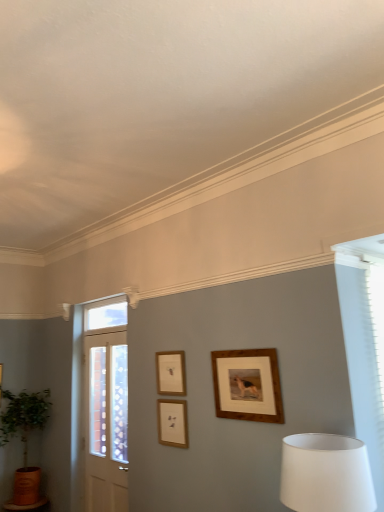
You are a GUI agent. You are given a task and a screenshot of the screen. Output one action in this format:
    pyautogui.click(x=<x>, y=<y>)
    Task: Click on the white wood door at left
    The image size is (384, 512).
    Given the screenshot: What is the action you would take?
    pyautogui.click(x=100, y=407)

This screenshot has width=384, height=512. What are the coordinates of `wooden picture frame at center, the second picture frame viewed from the left` in the screenshot? It's located at (172, 422).

The image size is (384, 512). What do you see at coordinates (24, 442) in the screenshot?
I see `green leafy plant in terracotta pot at lower left` at bounding box center [24, 442].

In order to click on white fabric lampshade at lower right in this screenshot , I will do click(x=326, y=473).

This screenshot has height=512, width=384. Find the location of `white wood door at left`. white wood door at left is located at coordinates (100, 407).

Is clear glass window at upper center positioned with its back to wooden picture frame at center, the second picture frame viewed from the left?

clear glass window at upper center does not have its back to wooden picture frame at center, the second picture frame viewed from the left.

Considering their positions, is clear glass window at upper center located in front of or behind wooden picture frame at center, the second picture frame viewed from the left?

Visually, clear glass window at upper center is located behind wooden picture frame at center, the second picture frame viewed from the left.

Which picture frame is the 2nd one when counting from the right side of the clear glass window at upper center? Please provide its 2D coordinates.

[(172, 422)]

From a real-world perspective, which object rests below the other?

wooden picture frame at center, the 2th picture frame viewed from the right, is physically lower.

From a real-world perspective, is wooden picture frame at center, which appears as the 3th picture frame when viewed from the left, below wooden picture frame at upper center, which ranks as the 1th picture frame in left-to-right order?

Yes, from a real-world perspective, wooden picture frame at center, which appears as the 3th picture frame when viewed from the left, is below wooden picture frame at upper center, which ranks as the 1th picture frame in left-to-right order.

From the image's perspective, is wooden picture frame at center, which appears as the 3th picture frame when viewed from the left, located above or below wooden picture frame at upper center, which ranks as the 1th picture frame in left-to-right order?

wooden picture frame at center, which appears as the 3th picture frame when viewed from the left, is above wooden picture frame at upper center, which ranks as the 1th picture frame in left-to-right order.

Is point (255, 361) in front of point (170, 380)?

That is True.

Which of these two, wooden picture frame at center, the 1th picture frame viewed from the right, or wooden picture frame at upper center, which ranks as the 1th picture frame in left-to-right order, is bigger?

wooden picture frame at center, the 1th picture frame viewed from the right, is bigger.

How different are the orientations of green leafy plant in terracotta pot at lower left and clear glass window at upper center in degrees?

They differ by 89.8 degrees in their facing directions.

Measure the distance between green leafy plant in terracotta pot at lower left and clear glass window at upper center.

A: green leafy plant in terracotta pot at lower left is 1.07 meters away from clear glass window at upper center.

Is the surface of green leafy plant in terracotta pot at lower left in direct contact with clear glass window at upper center?

green leafy plant in terracotta pot at lower left is not next to clear glass window at upper center, and they're not touching.

Based on their sizes in the image, would you say green leafy plant in terracotta pot at lower left is bigger or smaller than clear glass window at upper center?

In the image, green leafy plant in terracotta pot at lower left appears to be larger than clear glass window at upper center.

Between green leafy plant in terracotta pot at lower left and wooden picture frame at center, the 2th picture frame viewed from the right, which one has smaller width?

wooden picture frame at center, the 2th picture frame viewed from the right.

Between green leafy plant in terracotta pot at lower left and wooden picture frame at center, the second picture frame viewed from the left, which one is positioned behind?

green leafy plant in terracotta pot at lower left is more distant.

Is wooden picture frame at center, the second picture frame viewed from the left, surrounded by green leafy plant in terracotta pot at lower left?

No, green leafy plant in terracotta pot at lower left does not contain wooden picture frame at center, the second picture frame viewed from the left.

Is green leafy plant in terracotta pot at lower left positioned behind white wood door at left?

Yes, the depth of green leafy plant in terracotta pot at lower left is greater than that of white wood door at left.

Is green leafy plant in terracotta pot at lower left looking in the opposite direction of white wood door at left?

green leafy plant in terracotta pot at lower left does not have its back to white wood door at left.

From a real-world perspective, is green leafy plant in terracotta pot at lower left physically located above or below white wood door at left?

From a real-world perspective, green leafy plant in terracotta pot at lower left is physically below white wood door at left.

Which of these two, green leafy plant in terracotta pot at lower left or white wood door at left, is bigger?

With larger size is green leafy plant in terracotta pot at lower left.

Is wooden picture frame at upper center, which ranks as the 1th picture frame in left-to-right order, closer to the viewer compared to wooden picture frame at center, the 2th picture frame viewed from the right?

No, wooden picture frame at upper center, which ranks as the 1th picture frame in left-to-right order, is behind wooden picture frame at center, the 2th picture frame viewed from the right.

Can you confirm if wooden picture frame at upper center, positioned as the 3th picture frame in right-to-left order, is positioned to the right of wooden picture frame at center, the 2th picture frame viewed from the right?

In fact, wooden picture frame at upper center, positioned as the 3th picture frame in right-to-left order, is to the left of wooden picture frame at center, the 2th picture frame viewed from the right.

Identify the location of the 1st picture frame to the right when counting from the wooden picture frame at upper center, positioned as the 3th picture frame in right-to-left order. This screenshot has height=512, width=384. (172, 422).

In terms of size, does wooden picture frame at upper center, positioned as the 3th picture frame in right-to-left order, appear bigger or smaller than wooden picture frame at center, the second picture frame viewed from the left?

wooden picture frame at upper center, positioned as the 3th picture frame in right-to-left order, is bigger than wooden picture frame at center, the second picture frame viewed from the left.

From the picture: Is wooden picture frame at center, the second picture frame viewed from the left, aimed at clear glass window at upper center?

No, wooden picture frame at center, the second picture frame viewed from the left, is not facing towards clear glass window at upper center.

Is there a large distance between wooden picture frame at center, the second picture frame viewed from the left, and clear glass window at upper center?

Yes, wooden picture frame at center, the second picture frame viewed from the left, is far from clear glass window at upper center.

From the image's perspective, is wooden picture frame at center, the 2th picture frame viewed from the right, positioned above or below clear glass window at upper center?

From the image's perspective, wooden picture frame at center, the 2th picture frame viewed from the right, appears below clear glass window at upper center.

You are a GUI agent. You are given a task and a screenshot of the screen. Output one action in this format:
    pyautogui.click(x=<x>, y=<y>)
    Task: Click on the window lying above the wooden picture frame at center, the second picture frame viewed from the left (from the image's perspective)
    The width and height of the screenshot is (384, 512).
    Given the screenshot: What is the action you would take?
    pyautogui.click(x=106, y=316)

You are a GUI agent. You are given a task and a screenshot of the screen. Output one action in this format:
    pyautogui.click(x=<x>, y=<y>)
    Task: Click on the window on the left of wooden picture frame at center, the 2th picture frame viewed from the right
    The width and height of the screenshot is (384, 512).
    Given the screenshot: What is the action you would take?
    pyautogui.click(x=106, y=316)

There is a wooden picture frame at center, which appears as the 3th picture frame when viewed from the left. Identify the location of the 1st picture frame below it (from the image's perspective). (170, 373).

When comparing their distances from wooden picture frame at upper center, which ranks as the 1th picture frame in left-to-right order, does green leafy plant in terracotta pot at lower left or white wood door at left seem closer?

white wood door at left.

From the image, which object appears to be farther from white fabric lampshade at lower right, clear glass window at upper center or green leafy plant in terracotta pot at lower left?

Based on the image, green leafy plant in terracotta pot at lower left appears to be further to white fabric lampshade at lower right.

Looking at the image, which one is located closer to wooden picture frame at center, which appears as the 3th picture frame when viewed from the left, white wood door at left or wooden picture frame at center, the 2th picture frame viewed from the right?

wooden picture frame at center, the 2th picture frame viewed from the right, is positioned closer to the anchor wooden picture frame at center, which appears as the 3th picture frame when viewed from the left.

Considering their positions, is wooden picture frame at center, which appears as the 3th picture frame when viewed from the left, positioned closer to white wood door at left than green leafy plant in terracotta pot at lower left?

green leafy plant in terracotta pot at lower left.

Estimate the real-world distances between objects in this image. Which object is closer to wooden picture frame at upper center, which ranks as the 1th picture frame in left-to-right order, wooden picture frame at center, the second picture frame viewed from the left, or white fabric lampshade at lower right?

wooden picture frame at center, the second picture frame viewed from the left.

When comparing their distances from wooden picture frame at upper center, which ranks as the 1th picture frame in left-to-right order, does clear glass window at upper center or wooden picture frame at center, the 1th picture frame viewed from the right, seem further?

clear glass window at upper center is positioned further to the anchor wooden picture frame at upper center, which ranks as the 1th picture frame in left-to-right order.

When comparing their distances from wooden picture frame at center, the 2th picture frame viewed from the right, does white fabric lampshade at lower right or clear glass window at upper center seem further?

Among the two, white fabric lampshade at lower right is located further to wooden picture frame at center, the 2th picture frame viewed from the right.

Which object lies nearer to the anchor point white wood door at left, white fabric lampshade at lower right or wooden picture frame at center, the 2th picture frame viewed from the right?

wooden picture frame at center, the 2th picture frame viewed from the right, is positioned closer to the anchor white wood door at left.

This screenshot has height=512, width=384. I want to click on picture frame between wooden picture frame at center, the 1th picture frame viewed from the right, and wooden picture frame at upper center, which ranks as the 1th picture frame in left-to-right order, in the front-back direction, so click(172, 422).

This screenshot has height=512, width=384. I want to click on door between clear glass window at upper center and green leafy plant in terracotta pot at lower left from top to bottom, so click(100, 407).

The width and height of the screenshot is (384, 512). I want to click on picture frame positioned between wooden picture frame at center, the 2th picture frame viewed from the right, and clear glass window at upper center from near to far, so click(x=170, y=373).

Identify the location of picture frame located between green leafy plant in terracotta pot at lower left and wooden picture frame at center, the second picture frame viewed from the left, in the left-right direction. Image resolution: width=384 pixels, height=512 pixels. (170, 373).